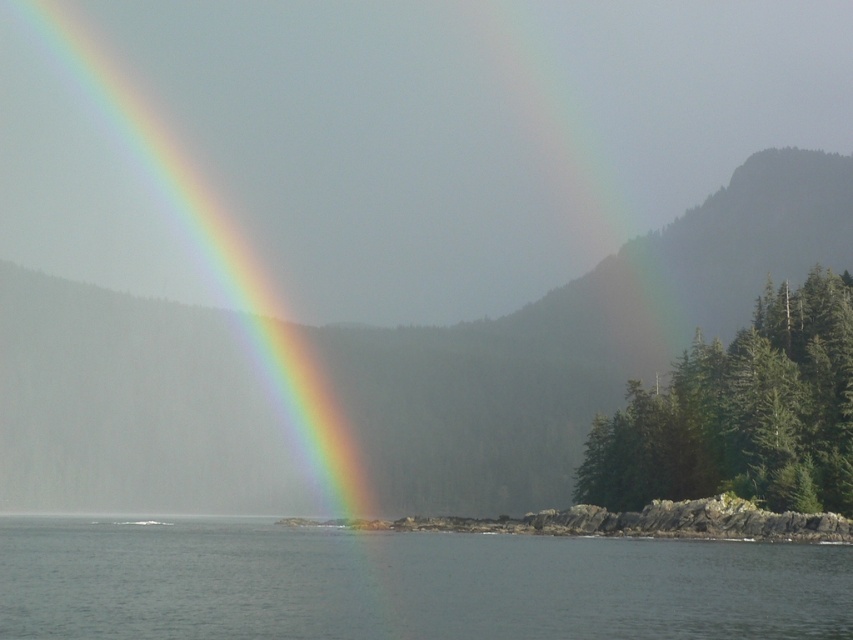
Which of these two, clear water at lower center or green matte trees at right, stands shorter?

clear water at lower center is shorter.

Who is more distant from viewer, (329, 609) or (660, 451)?

Point (660, 451)

Is point (788, 557) farther from viewer compared to point (637, 497)?

No, (788, 557) is in front of (637, 497).

At what (x,y) coordinates should I click in order to perform the action: click on clear water at lower center. Please return your answer as a coordinate pair (x, y). Image resolution: width=853 pixels, height=640 pixels. Looking at the image, I should click on (403, 582).

Does point (45, 230) come behind point (741, 436)?

Yes.

Does rainbow at left have a greater height compared to green matte trees at right?

Yes.

Who is more forward, (78, 428) or (795, 502)?

Point (795, 502) is more forward.

At what (x,y) coordinates should I click in order to perform the action: click on rainbow at left. Please return your answer as a coordinate pair (x, y). The image size is (853, 640). Looking at the image, I should click on (231, 243).

Can you confirm if rainbow at left is wider than clear water at lower center?

Indeed, rainbow at left has a greater width compared to clear water at lower center.

Image resolution: width=853 pixels, height=640 pixels. Find the location of `rainbow at left`. rainbow at left is located at coordinates (231, 243).